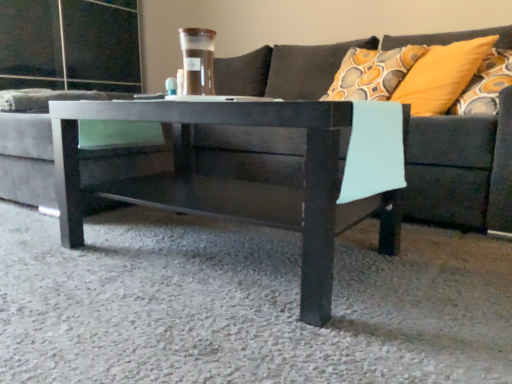
Describe the element at coordinates (255, 183) in the screenshot. I see `matte black coffee table at center` at that location.

This screenshot has height=384, width=512. I want to click on dark gray fabric couch at center, so click(461, 170).

Is dark gray fabric couch at center wider or thinner than matte black coffee table at center?

In the image, dark gray fabric couch at center appears to be wider than matte black coffee table at center.

Considering the points (33, 179) and (301, 286), which point is behind, point (33, 179) or point (301, 286)?

Point (33, 179)

Which object is positioned more to the right, dark gray fabric couch at center or matte black coffee table at center?

Positioned to the right is dark gray fabric couch at center.

Can you tell me how much dark gray fabric couch at center and matte black coffee table at center differ in facing direction?

dark gray fabric couch at center and matte black coffee table at center are facing 1.49 degrees away from each other.

Would you say yellow fabric pillow at upper right is outside matte black coffee table at center?

Yes, yellow fabric pillow at upper right is not within matte black coffee table at center.

Is yellow fabric pillow at upper right looking in the opposite direction of matte black coffee table at center?

No, yellow fabric pillow at upper right is not facing the opposite direction of matte black coffee table at center.

Does point (430, 106) come in front of point (396, 184)?

No.

Does yellow fabric pillow at upper right have a lesser height compared to matte black coffee table at center?

In fact, yellow fabric pillow at upper right may be taller than matte black coffee table at center.

Between matte black coffee table at center and dark gray fabric couch at center, which one has more height?

dark gray fabric couch at center is taller.

In the scene shown: From a real-world perspective, is matte black coffee table at center on dark gray fabric couch at center?

No.

Based on the photo, which is behind, matte black coffee table at center or dark gray fabric couch at center?

matte black coffee table at center is more distant.

Considering the relative sizes of yellow fabric pillow at upper right and dark gray fabric couch at center in the image provided, is yellow fabric pillow at upper right taller than dark gray fabric couch at center?

Incorrect, the height of yellow fabric pillow at upper right is not larger of that of dark gray fabric couch at center.

From the picture: What's the angular difference between yellow fabric pillow at upper right and dark gray fabric couch at center's facing directions?

There is a 24.3-degree angle between the facing directions of yellow fabric pillow at upper right and dark gray fabric couch at center.

From the image's perspective, is yellow fabric pillow at upper right located beneath dark gray fabric couch at center?

No, from the image's perspective, yellow fabric pillow at upper right is not beneath dark gray fabric couch at center.

Would you say dark gray fabric couch at center is part of yellow fabric pillow at upper right's contents?

Actually, dark gray fabric couch at center is outside yellow fabric pillow at upper right.

Can you confirm if dark gray fabric couch at center is bigger than yellow fabric pillow at upper right?

Yes.

Is dark gray fabric couch at center positioned with its back to yellow fabric pillow at upper right?

That's not correct — dark gray fabric couch at center is not looking away from yellow fabric pillow at upper right.

Is dark gray fabric couch at center in front of or behind yellow fabric pillow at upper right in the image?

Clearly, dark gray fabric couch at center is in front of yellow fabric pillow at upper right.

Can we say matte black coffee table at center lies outside yellow fabric pillow at upper right?

matte black coffee table at center lies outside yellow fabric pillow at upper right's area.

How much distance is there between matte black coffee table at center and yellow fabric pillow at upper right?

They are 30.52 inches apart.

Could you tell me if matte black coffee table at center is turned towards yellow fabric pillow at upper right?

No.

Can you confirm if matte black coffee table at center is bigger than yellow fabric pillow at upper right?

Indeed, matte black coffee table at center has a larger size compared to yellow fabric pillow at upper right.

At what (x,y) coordinates should I click in order to perform the action: click on coffee table lying on the left of dark gray fabric couch at center. Please return your answer as a coordinate pair (x, y). Image resolution: width=512 pixels, height=384 pixels. Looking at the image, I should click on (255, 183).

Where is `pillow behind the matte black coffee table at center`? The image size is (512, 384). pillow behind the matte black coffee table at center is located at coordinates (442, 75).

Considering their positions, is matte black coffee table at center positioned further to dark gray fabric couch at center than yellow fabric pillow at upper right?

matte black coffee table at center.

Looking at this image, estimate the real-world distances between objects in this image. Which object is further from matte black coffee table at center, dark gray fabric couch at center or yellow fabric pillow at upper right?

dark gray fabric couch at center is further to matte black coffee table at center.

Estimate the real-world distances between objects in this image. Which object is further from dark gray fabric couch at center, yellow fabric pillow at upper right or matte black coffee table at center?

The object further to dark gray fabric couch at center is matte black coffee table at center.

Which object lies further to the anchor point matte black coffee table at center, yellow fabric pillow at upper right or dark gray fabric couch at center?

The object further to matte black coffee table at center is dark gray fabric couch at center.

Estimate the real-world distances between objects in this image. Which object is further from yellow fabric pillow at upper right, dark gray fabric couch at center or matte black coffee table at center?

matte black coffee table at center is further to yellow fabric pillow at upper right.

Looking at the image, which one is located closer to yellow fabric pillow at upper right, matte black coffee table at center or dark gray fabric couch at center?

The object closer to yellow fabric pillow at upper right is dark gray fabric couch at center.

The width and height of the screenshot is (512, 384). What are the coordinates of `studio couch situated between matte black coffee table at center and yellow fabric pillow at upper right from left to right` in the screenshot? It's located at (461, 170).